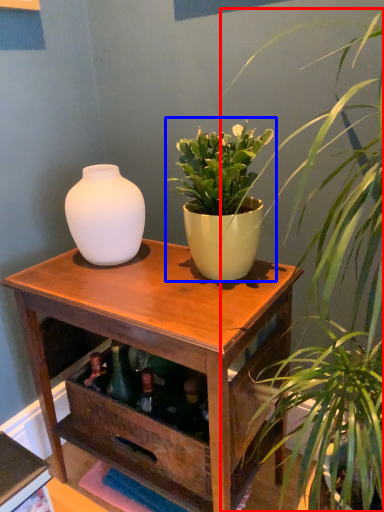
Question: Which point is closer to the camera, houseplant (highlighted by a red box) or houseplant (highlighted by a blue box)?

Choices:
 (A) houseplant
 (B) houseplant

Answer: (A)